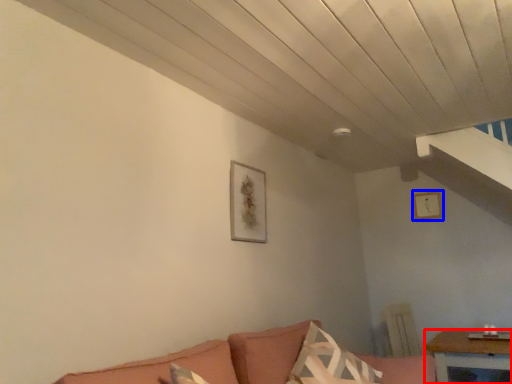
Question: Among these objects, which one is nearest to the camera, table (highlighted by a red box) or picture frame (highlighted by a blue box)?

Choices:
 (A) table
 (B) picture frame

Answer: (A)